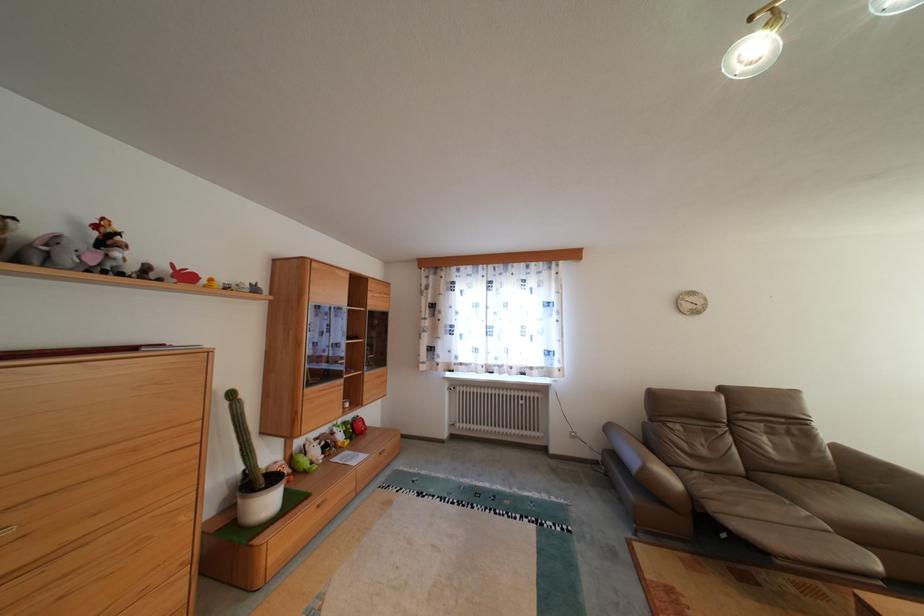
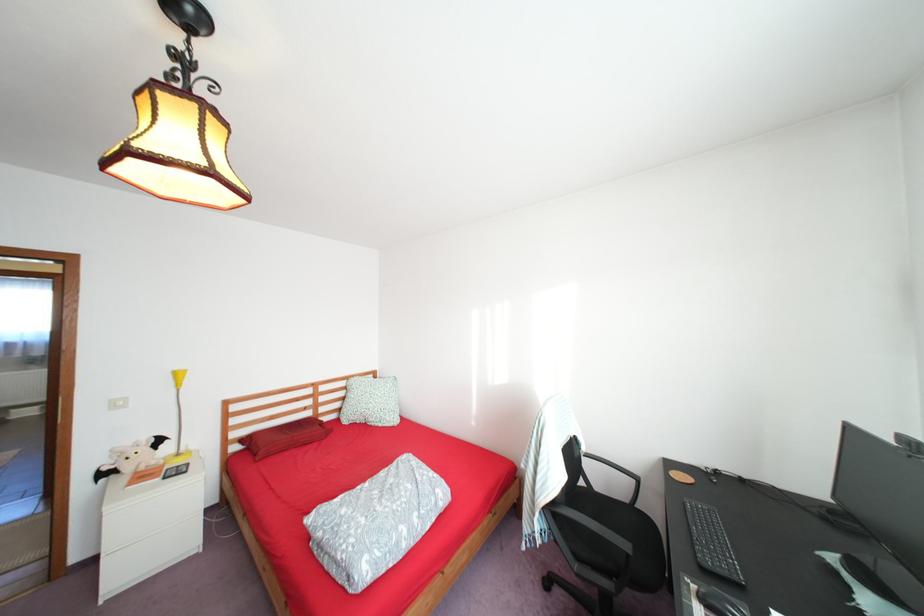
Question: I am providing you with two images of the same scene from different viewpoints. After the viewpoint changes to image2, which objects are now occluded?

Choices:
 (A) green stuffed frog
 (B) chair sitting surface
 (C) shelf module handle
 (D) bat plush toy

Answer: (A)